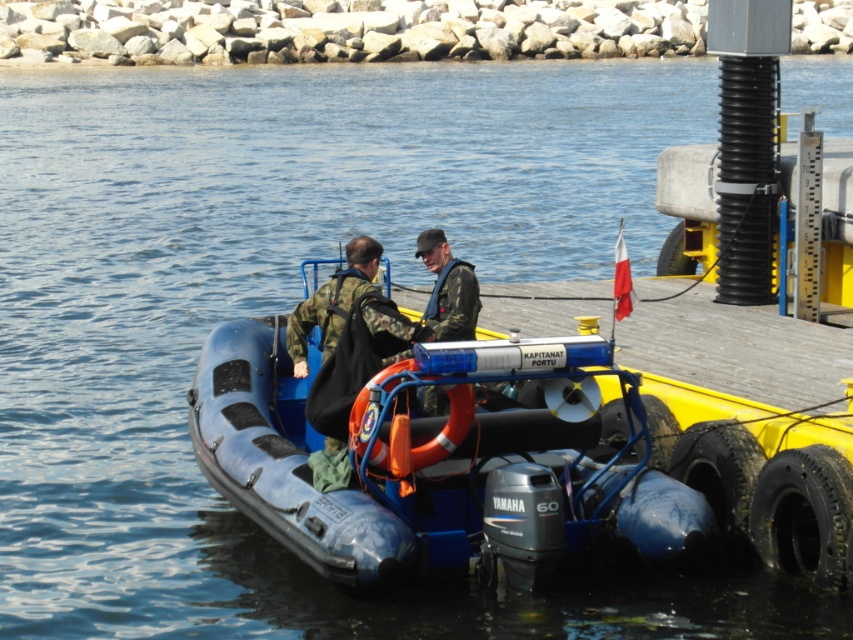
Between blue rubber boat at center and orange rubber life jacket at center, which one has less height?

Standing shorter between the two is orange rubber life jacket at center.

Is blue rubber boat at center closer to camera compared to orange rubber life jacket at center?

Yes.

Which is behind, point (628, 477) or point (387, 454)?

The point (628, 477) is more distant.

Identify the location of blue rubber boat at center. (439, 461).